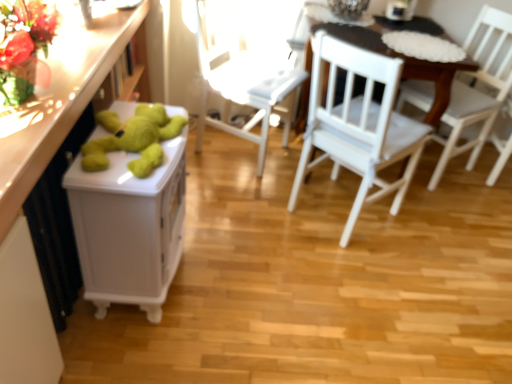
Question: From a real-world perspective, is white wood chair at right, which is the third chair from left to right, located beneath green plush bear at left?

Choices:
 (A) yes
 (B) no

Answer: (A)

Question: From a real-world perspective, is white wood chair at right, which is counted as the first chair, starting from the right, on top of green plush bear at left?

Choices:
 (A) yes
 (B) no

Answer: (B)

Question: Is white wood chair at right, which is the third chair from left to right, looking in the opposite direction of green plush bear at left?

Choices:
 (A) yes
 (B) no

Answer: (B)

Question: Is white wood chair at right, which is counted as the first chair, starting from the right, closer to the viewer compared to green plush bear at left?

Choices:
 (A) yes
 (B) no

Answer: (B)

Question: Is green plush bear at left inside white wood chair at right, which is the third chair from left to right?

Choices:
 (A) yes
 (B) no

Answer: (B)

Question: Would you say green plush bear at left is inside or outside white wooden table at center?

Choices:
 (A) inside
 (B) outside

Answer: (B)

Question: Considering their positions, is green plush bear at left located in front of or behind white wooden table at center?

Choices:
 (A) behind
 (B) front

Answer: (B)

Question: In terms of size, does green plush bear at left appear bigger or smaller than white wooden table at center?

Choices:
 (A) big
 (B) small

Answer: (B)

Question: From the image's perspective, is green plush bear at left located above or below white wooden table at center?

Choices:
 (A) above
 (B) below

Answer: (B)

Question: From a real-world perspective, is green plush bear at left above or below green plush toy at left?

Choices:
 (A) below
 (B) above

Answer: (A)

Question: Is point (101, 170) closer or farther from the camera than point (61, 92)?

Choices:
 (A) farther
 (B) closer

Answer: (B)

Question: Considering the positions of green plush bear at left and green plush toy at left in the image, is green plush bear at left taller or shorter than green plush toy at left?

Choices:
 (A) short
 (B) tall

Answer: (A)

Question: From the image's perspective, is green plush bear at left positioned above or below green plush toy at left?

Choices:
 (A) above
 (B) below

Answer: (B)

Question: From a real-world perspective, is green plush bear at left physically located above or below white wood chair at center, the second chair from the left?

Choices:
 (A) below
 (B) above

Answer: (B)

Question: Would you say green plush bear at left is inside or outside white wood chair at center, the second chair from the left?

Choices:
 (A) inside
 (B) outside

Answer: (B)